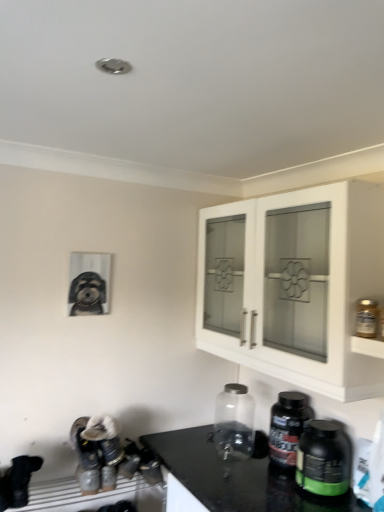
Question: From the image's perspective, is transparent glass jar at center, acting as the 1th bottle starting from the back, located beneath matte black dog at left?

Choices:
 (A) yes
 (B) no

Answer: (A)

Question: From a real-world perspective, does transparent glass jar at center, acting as the 1th bottle starting from the back, sit lower than matte black dog at left?

Choices:
 (A) yes
 (B) no

Answer: (A)

Question: Can you confirm if transparent glass jar at center, acting as the 1th bottle starting from the back, is taller than matte black dog at left?

Choices:
 (A) yes
 (B) no

Answer: (A)

Question: Could you tell me if transparent glass jar at center, acting as the 1th bottle starting from the back, is turned towards matte black dog at left?

Choices:
 (A) yes
 (B) no

Answer: (B)

Question: Is transparent glass jar at center, the fourth bottle viewed from the front, facing away from matte black dog at left?

Choices:
 (A) yes
 (B) no

Answer: (B)

Question: Is white glass cabinet at upper right inside or outside of matte black dog at left?

Choices:
 (A) inside
 (B) outside

Answer: (B)

Question: Considering the positions of white glass cabinet at upper right and matte black dog at left in the image, is white glass cabinet at upper right wider or thinner than matte black dog at left?

Choices:
 (A) wide
 (B) thin

Answer: (A)

Question: In terms of height, does white glass cabinet at upper right look taller or shorter compared to matte black dog at left?

Choices:
 (A) tall
 (B) short

Answer: (A)

Question: Is white glass cabinet at upper right in front of or behind matte black dog at left in the image?

Choices:
 (A) front
 (B) behind

Answer: (A)

Question: Is transparent glass jar at center, acting as the 1th bottle starting from the back, wider or thinner than black plastic bottle at lower right, the 2th bottle from the back?

Choices:
 (A) thin
 (B) wide

Answer: (B)

Question: Does point (251, 431) appear closer or farther from the camera than point (284, 408)?

Choices:
 (A) closer
 (B) farther

Answer: (B)

Question: Is transparent glass jar at center, acting as the 1th bottle starting from the back, spatially inside black plastic bottle at lower right, the 3th bottle viewed from the front, or outside of it?

Choices:
 (A) outside
 (B) inside

Answer: (A)

Question: Is transparent glass jar at center, the fourth bottle viewed from the front, taller or shorter than black plastic bottle at lower right, the 2th bottle from the back?

Choices:
 (A) tall
 (B) short

Answer: (A)

Question: In terms of height, does transparent glass jar at center, the fourth bottle viewed from the front, look taller or shorter compared to clear glass jar at upper right, placed as the fourth bottle when sorted from back to front?

Choices:
 (A) tall
 (B) short

Answer: (A)

Question: Is transparent glass jar at center, acting as the 1th bottle starting from the back, in front of or behind clear glass jar at upper right, the 1th bottle positioned from the front, in the image?

Choices:
 (A) behind
 (B) front

Answer: (A)